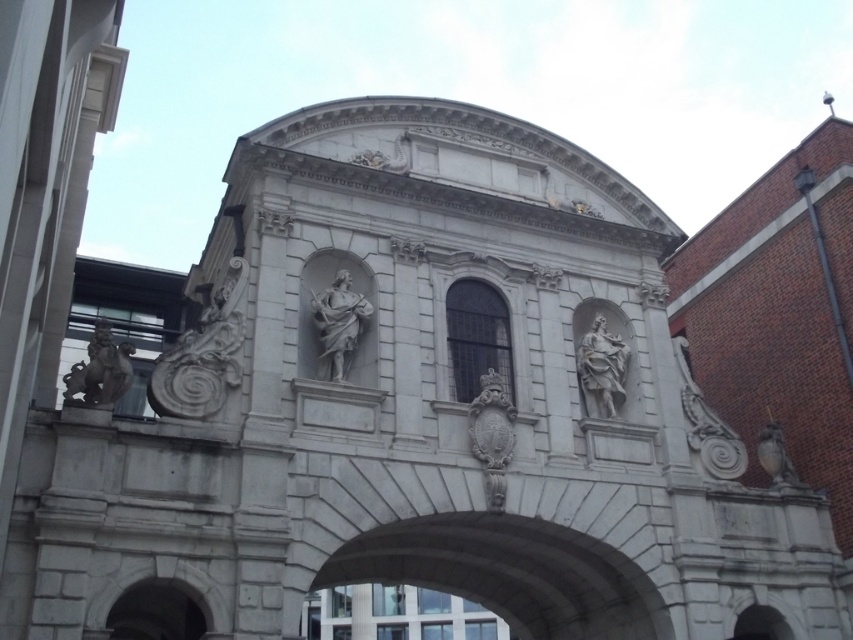
Question: Among these points, which one is farthest from the camera?

Choices:
 (A) (456, 296)
 (B) (589, 413)
 (C) (93, 337)
 (D) (759, 435)

Answer: (D)

Question: Among these objects, which one is nearest to the camera?

Choices:
 (A) gray stone lion at left
 (B) matte white statue at right
 (C) white marble statue at center

Answer: (A)

Question: Observing the image, what is the correct spatial positioning of white stone carving at upper left in reference to gray stone lion at left?

Choices:
 (A) left
 (B) right

Answer: (B)

Question: Does clear glass window at center come in front of gray stone lion at left?

Choices:
 (A) yes
 (B) no

Answer: (B)

Question: Is white marble statue at center positioned behind matte white statue at right?

Choices:
 (A) yes
 (B) no

Answer: (B)

Question: Which object is positioned farthest from the gray stone lion at left?

Choices:
 (A) white marble statue at center
 (B) clear glass window at center

Answer: (B)